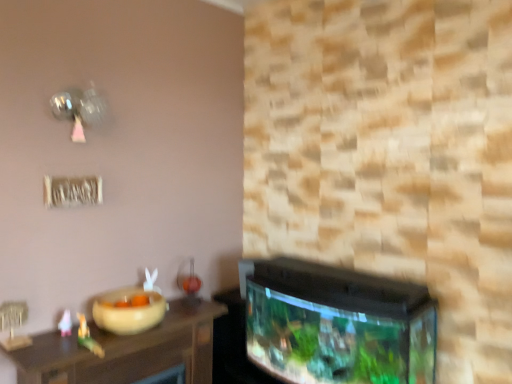
In order to face wooden table at lower left, should I rotate leftwards or rightwards?

To face it directly, rotate left by 16.422 degrees.

Image resolution: width=512 pixels, height=384 pixels. What do you see at coordinates (129, 311) in the screenshot?
I see `beige matte bowl at lower left` at bounding box center [129, 311].

At what (x,y) coordinates should I click in order to perform the action: click on beige matte bowl at lower left. Please return your answer as a coordinate pair (x, y). Looking at the image, I should click on (129, 311).

The image size is (512, 384). I want to click on pink paper airplane at lower left, marked as the second toy in a front-to-back arrangement, so click(65, 323).

Is wooden table at lower left positioned behind pink paper airplane at lower left, which ranks as the 1th toy in back-to-front order?

No, wooden table at lower left is closer to the viewer.

From a real-world perspective, is wooden table at lower left beneath pink paper airplane at lower left, marked as the second toy in a front-to-back arrangement?

Indeed, from a real-world perspective, wooden table at lower left is positioned beneath pink paper airplane at lower left, marked as the second toy in a front-to-back arrangement.

Considering the relative positions of wooden table at lower left and pink paper airplane at lower left, placed as the first toy when sorted from left to right, in the image provided, is wooden table at lower left to the right of pink paper airplane at lower left, placed as the first toy when sorted from left to right, from the viewer's perspective?

Indeed, wooden table at lower left is positioned on the right side of pink paper airplane at lower left, placed as the first toy when sorted from left to right.

Who is shorter, wooden table at lower left or pink paper airplane at lower left, which is the second toy in right-to-left order?

Standing shorter between the two is wooden table at lower left.

Between matte green toy at left, which appears as the first toy when viewed from the front, and beige matte bowl at lower left, which one has smaller width?

Thinner between the two is matte green toy at left, which appears as the first toy when viewed from the front.

In terms of size, does matte green toy at left, which is the 2th toy from left to right, appear bigger or smaller than beige matte bowl at lower left?

Considering their sizes, matte green toy at left, which is the 2th toy from left to right, takes up less space than beige matte bowl at lower left.

Looking at this image, measure the distance from matte green toy at left, the 2th toy from the back, to beige matte bowl at lower left.

matte green toy at left, the 2th toy from the back, and beige matte bowl at lower left are 6.79 inches apart.

I want to click on bowl that is above the matte green toy at left, the 2th toy from the back (from the image's perspective), so click(x=129, y=311).

From a real-world perspective, is matte green toy at left, which is the 2th toy from left to right, on pink paper airplane at lower left, placed as the first toy when sorted from left to right?

No.

What's the angular difference between matte green toy at left, acting as the 1th toy starting from the right, and pink paper airplane at lower left, which ranks as the 1th toy in back-to-front order,'s facing directions?

1.07 degrees.

From the image's perspective, is matte green toy at left, which appears as the first toy when viewed from the front, beneath pink paper airplane at lower left, placed as the first toy when sorted from left to right?

Yes, from the image's perspective, matte green toy at left, which appears as the first toy when viewed from the front, is below pink paper airplane at lower left, placed as the first toy when sorted from left to right.

Could you measure the distance between beige matte bowl at lower left and pink paper airplane at lower left, placed as the first toy when sorted from left to right?

They are 23.30 centimeters apart.

Where is `toy that is the 1st one below the beige matte bowl at lower left (from a real-world perspective)`? toy that is the 1st one below the beige matte bowl at lower left (from a real-world perspective) is located at coordinates (65, 323).

From a real-world perspective, is beige matte bowl at lower left physically located above or below pink paper airplane at lower left, which is the second toy in right-to-left order?

From a real-world perspective, beige matte bowl at lower left is physically above pink paper airplane at lower left, which is the second toy in right-to-left order.

Is beige matte bowl at lower left closer to the viewer compared to pink paper airplane at lower left, which is the second toy in right-to-left order?

That is True.

From the picture: Considering the relative sizes of beige matte bowl at lower left and wooden table at lower left in the image provided, is beige matte bowl at lower left taller than wooden table at lower left?

Yes.

The image size is (512, 384). Identify the location of table that is under the beige matte bowl at lower left (from a real-world perspective). (126, 350).

Can you confirm if beige matte bowl at lower left is thinner than wooden table at lower left?

No.

From a real-world perspective, which object rests below the other?

wooden table at lower left is physically lower.

Can you confirm if beige matte bowl at lower left is wider than matte green toy at left, acting as the 1th toy starting from the right?

Correct, the width of beige matte bowl at lower left exceeds that of matte green toy at left, acting as the 1th toy starting from the right.

Considering the relative positions of beige matte bowl at lower left and matte green toy at left, which appears as the first toy when viewed from the front, in the image provided, is beige matte bowl at lower left to the right of matte green toy at left, which appears as the first toy when viewed from the front, from the viewer's perspective?

Yes, beige matte bowl at lower left is to the right of matte green toy at left, which appears as the first toy when viewed from the front.

From the image's perspective, does beige matte bowl at lower left appear lower than matte green toy at left, the 2th toy from the back?

Incorrect, from the image's perspective, beige matte bowl at lower left is higher than matte green toy at left, the 2th toy from the back.

In the scene shown: Which of these two, pink paper airplane at lower left, placed as the first toy when sorted from left to right, or matte green toy at left, which is the 2th toy from left to right, stands taller?

Standing taller between the two is matte green toy at left, which is the 2th toy from left to right.

From the image's perspective, is pink paper airplane at lower left, marked as the second toy in a front-to-back arrangement, located beneath matte green toy at left, which is the 2th toy from left to right?

No, from the image's perspective, pink paper airplane at lower left, marked as the second toy in a front-to-back arrangement, is not beneath matte green toy at left, which is the 2th toy from left to right.

Are pink paper airplane at lower left, which ranks as the 1th toy in back-to-front order, and matte green toy at left, acting as the 1th toy starting from the right, far apart?

pink paper airplane at lower left, which ranks as the 1th toy in back-to-front order, is actually quite close to matte green toy at left, acting as the 1th toy starting from the right.

Locate an element on the screen. The width and height of the screenshot is (512, 384). the 2nd toy behind when counting from the wooden table at lower left is located at coordinates (65, 323).

In order to click on bowl located on the right of matte green toy at left, acting as the 1th toy starting from the right in this screenshot , I will do `click(129, 311)`.

Estimate the real-world distances between objects in this image. Which object is further from wooden table at lower left, matte green toy at left, which is the 2th toy from left to right, or beige matte bowl at lower left?

The object further to wooden table at lower left is matte green toy at left, which is the 2th toy from left to right.

Looking at the image, which one is located closer to beige matte bowl at lower left, wooden table at lower left or pink paper airplane at lower left, which ranks as the 1th toy in back-to-front order?

The object closer to beige matte bowl at lower left is wooden table at lower left.

Which object lies nearer to the anchor point pink paper airplane at lower left, which is the second toy in right-to-left order, beige matte bowl at lower left or matte green toy at left, which appears as the first toy when viewed from the front?

matte green toy at left, which appears as the first toy when viewed from the front, lies closer to pink paper airplane at lower left, which is the second toy in right-to-left order, than the other object.

Based on their spatial positions, is beige matte bowl at lower left or matte green toy at left, acting as the 1th toy starting from the right, closer to wooden table at lower left?

beige matte bowl at lower left is positioned closer to the anchor wooden table at lower left.

Looking at the image, which one is located further to beige matte bowl at lower left, pink paper airplane at lower left, marked as the second toy in a front-to-back arrangement, or matte green toy at left, the 2th toy from the back?

pink paper airplane at lower left, marked as the second toy in a front-to-back arrangement, lies further to beige matte bowl at lower left than the other object.

When comparing their distances from matte green toy at left, the 2th toy from the back, does beige matte bowl at lower left or wooden table at lower left seem further?

Among the two, wooden table at lower left is located further to matte green toy at left, the 2th toy from the back.

From the picture: Based on their spatial positions, is wooden table at lower left or beige matte bowl at lower left closer to pink paper airplane at lower left, which ranks as the 1th toy in back-to-front order?

beige matte bowl at lower left lies closer to pink paper airplane at lower left, which ranks as the 1th toy in back-to-front order, than the other object.

Which object lies nearer to the anchor point pink paper airplane at lower left, which is the second toy in right-to-left order, wooden table at lower left or matte green toy at left, the 2th toy from the back?

matte green toy at left, the 2th toy from the back, is closer to pink paper airplane at lower left, which is the second toy in right-to-left order.

I want to click on toy between wooden table at lower left and beige matte bowl at lower left in the front-back direction, so click(88, 337).

I want to click on toy between wooden table at lower left and pink paper airplane at lower left, placed as the first toy when sorted from left to right, from front to back, so click(x=88, y=337).

Locate an element on the screen. This screenshot has width=512, height=384. toy between pink paper airplane at lower left, which is the second toy in right-to-left order, and beige matte bowl at lower left from left to right is located at coordinates (88, 337).

The image size is (512, 384). Identify the location of bowl between wooden table at lower left and pink paper airplane at lower left, which ranks as the 1th toy in back-to-front order, from front to back. (129, 311).